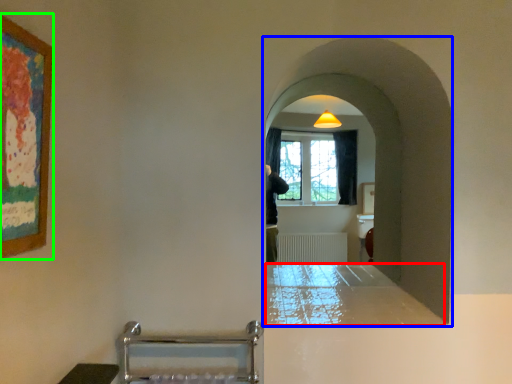
Question: Estimate the real-world distances between objects in this image. Which object is farther from counter top (highlighted by a red box), passage (highlighted by a blue box) or picture frame (highlighted by a green box)?

Choices:
 (A) passage
 (B) picture frame

Answer: (B)